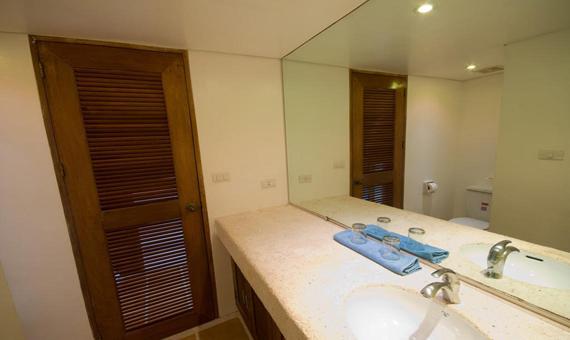
Where is `reflection of lights in cieling`? This screenshot has width=570, height=340. reflection of lights in cieling is located at coordinates (424, 8), (471, 67).